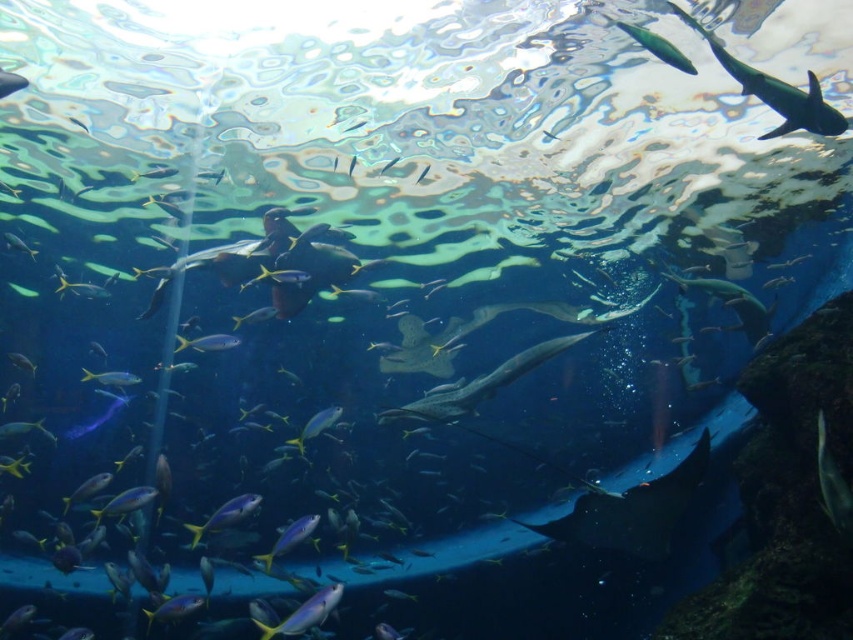
Looking at this image, you are an underwater photographer aiming to capture a clear shot of both the small fish and the larger shark. You are positioned at the center of the aquarium. Which point, point (393, 412) or point (286, 532), is closer to you and would allow for a better closeup without moving your position?

Point (393, 412) is closer to you than point (286, 532), so it would allow for a better closeup without moving your position.

Where is the blue glossy fish at lower left located in the image?

The blue glossy fish at lower left is located at point (225,515) in the image.